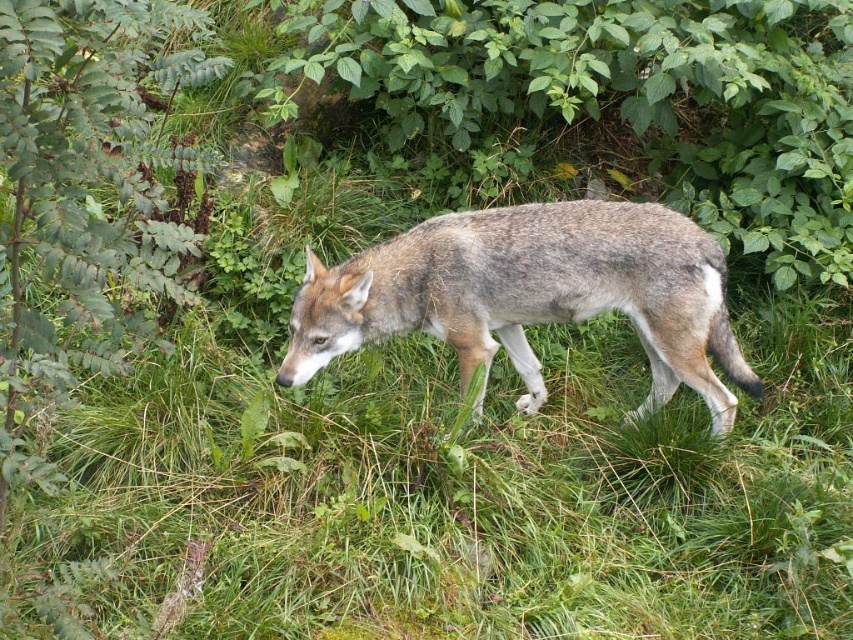
Question: Among these points, which one is nearest to the camera?

Choices:
 (A) (650, 353)
 (B) (207, 60)

Answer: (B)

Question: Which point is farther to the camera?

Choices:
 (A) (505, 227)
 (B) (161, 196)

Answer: (A)

Question: Can you confirm if green leafy bush at left is wider than gray fur wolf at center?

Choices:
 (A) yes
 (B) no

Answer: (B)

Question: Where is green leafy bush at left located in relation to gray fur wolf at center in the image?

Choices:
 (A) below
 (B) above

Answer: (B)

Question: Is green leafy bush at left wider than gray fur wolf at center?

Choices:
 (A) yes
 (B) no

Answer: (B)